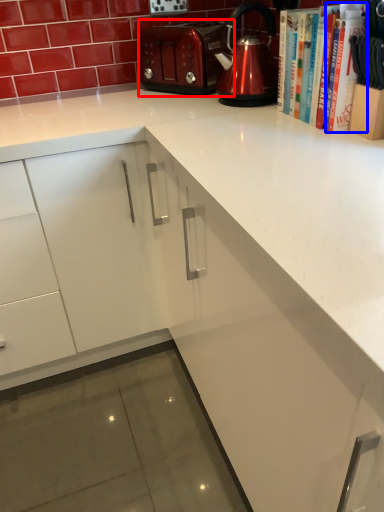
Question: Which object appears closest to the camera in this image, toaster (highlighted by a red box) or book (highlighted by a blue box)?

Choices:
 (A) toaster
 (B) book

Answer: (B)